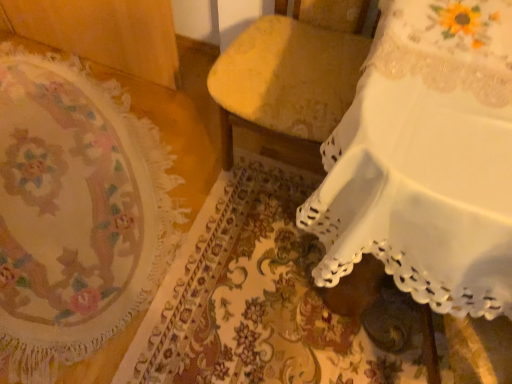
What do you see at coordinates (426, 160) in the screenshot? I see `white lace tablecloth at upper right, the 1th furniture from the right` at bounding box center [426, 160].

The width and height of the screenshot is (512, 384). What do you see at coordinates (76, 212) in the screenshot? I see `floral tapestry at left` at bounding box center [76, 212].

This screenshot has height=384, width=512. Find the location of `white lace tablecloth at upper right, the 1th furniture from the right`. white lace tablecloth at upper right, the 1th furniture from the right is located at coordinates (426, 160).

From a real-world perspective, who is located higher, velvet yellow chair at center, which appears as the second furniture when viewed from the right, or floral tapestry at left?

From a 3D spatial view, velvet yellow chair at center, which appears as the second furniture when viewed from the right, is above.

From the image's perspective, is velvet yellow chair at center, which ranks as the first furniture in left-to-right order, on floral tapestry at left?

Yes, from the image's perspective, velvet yellow chair at center, which ranks as the first furniture in left-to-right order, is on top of floral tapestry at left.

Is velvet yellow chair at center, which appears as the second furniture when viewed from the right, taller than floral tapestry at left?

Indeed, velvet yellow chair at center, which appears as the second furniture when viewed from the right, has a greater height compared to floral tapestry at left.

Is velvet yellow chair at center, which appears as the second furniture when viewed from the right, oriented towards floral tapestry at left?

No, velvet yellow chair at center, which appears as the second furniture when viewed from the right, is not facing towards floral tapestry at left.

Consider the image. Is velvet yellow chair at center, which appears as the second furniture when viewed from the right, in front of white lace tablecloth at upper right, which appears as the second furniture when viewed from the left?

That is False.

Which of these two, velvet yellow chair at center, which ranks as the first furniture in left-to-right order, or white lace tablecloth at upper right, the 1th furniture from the right, is smaller?

Smaller between the two is velvet yellow chair at center, which ranks as the first furniture in left-to-right order.

Is velvet yellow chair at center, which ranks as the first furniture in left-to-right order, turned away from white lace tablecloth at upper right, which appears as the second furniture when viewed from the left?

No.

Who is shorter, velvet yellow chair at center, which ranks as the first furniture in left-to-right order, or white lace tablecloth at upper right, which appears as the second furniture when viewed from the left?

With less height is white lace tablecloth at upper right, which appears as the second furniture when viewed from the left.

Would you say floral tapestry at left is outside velvet yellow chair at center, which ranks as the first furniture in left-to-right order?

Yes, floral tapestry at left is outside of velvet yellow chair at center, which ranks as the first furniture in left-to-right order.

Which is more distant, (x=41, y=214) or (x=306, y=38)?

The point (x=41, y=214) is behind.

From the image's perspective, between floral tapestry at left and velvet yellow chair at center, which appears as the second furniture when viewed from the right, which one is located above?

velvet yellow chair at center, which appears as the second furniture when viewed from the right, is shown above in the image.

Considering the sizes of white lace tablecloth at upper right, the 1th furniture from the right, and floral tapestry at left in the image, is white lace tablecloth at upper right, the 1th furniture from the right, taller or shorter than floral tapestry at left?

Considering their sizes, white lace tablecloth at upper right, the 1th furniture from the right, has more height than floral tapestry at left.

Is point (482, 231) less distant than point (8, 369)?

That is True.

Consider the image. Could you tell me if white lace tablecloth at upper right, the 1th furniture from the right, is turned towards floral tapestry at left?

No, white lace tablecloth at upper right, the 1th furniture from the right, does not turn towards floral tapestry at left.

Can you confirm if white lace tablecloth at upper right, which appears as the second furniture when viewed from the left, is smaller than floral tapestry at left?

No, white lace tablecloth at upper right, which appears as the second furniture when viewed from the left, is not smaller than floral tapestry at left.

Is white lace tablecloth at upper right, the 1th furniture from the right, taller than velvet yellow chair at center, which appears as the second furniture when viewed from the right?

No, white lace tablecloth at upper right, the 1th furniture from the right, is not taller than velvet yellow chair at center, which appears as the second furniture when viewed from the right.

Which of these two, white lace tablecloth at upper right, the 1th furniture from the right, or velvet yellow chair at center, which ranks as the first furniture in left-to-right order, is bigger?

With larger size is white lace tablecloth at upper right, the 1th furniture from the right.

From the image's perspective, between white lace tablecloth at upper right, which appears as the second furniture when viewed from the left, and velvet yellow chair at center, which ranks as the first furniture in left-to-right order, who is located below?

white lace tablecloth at upper right, which appears as the second furniture when viewed from the left, from the image's perspective.

From a real-world perspective, between white lace tablecloth at upper right, the 1th furniture from the right, and velvet yellow chair at center, which appears as the second furniture when viewed from the right, who is vertically higher?

velvet yellow chair at center, which appears as the second furniture when viewed from the right, from a real-world perspective.

Can you confirm if floral tapestry at left is positioned to the left of white lace tablecloth at upper right, which appears as the second furniture when viewed from the left?

Yes, floral tapestry at left is to the left of white lace tablecloth at upper right, which appears as the second furniture when viewed from the left.

Find the location of a particular element. This screenshot has height=384, width=512. the 2nd furniture to the right of the floral tapestry at left, counting from the anchor's position is located at coordinates (426, 160).

Is floral tapestry at left closer to camera compared to white lace tablecloth at upper right, the 1th furniture from the right?

No, it is behind white lace tablecloth at upper right, the 1th furniture from the right.

Is floral tapestry at left far away from white lace tablecloth at upper right, the 1th furniture from the right?

No, floral tapestry at left is in close proximity to white lace tablecloth at upper right, the 1th furniture from the right.

Where is `mat below the velvet yellow chair at center, which ranks as the first furniture in left-to-right order (from a real-world perspective)`? This screenshot has height=384, width=512. mat below the velvet yellow chair at center, which ranks as the first furniture in left-to-right order (from a real-world perspective) is located at coordinates (76, 212).

The width and height of the screenshot is (512, 384). Find the location of `furniture above the white lace tablecloth at upper right, which appears as the second furniture when viewed from the left (from the image's perspective)`. furniture above the white lace tablecloth at upper right, which appears as the second furniture when viewed from the left (from the image's perspective) is located at coordinates (291, 73).

Considering their positions, is white lace tablecloth at upper right, which appears as the second furniture when viewed from the left, positioned further to floral tapestry at left than velvet yellow chair at center, which ranks as the first furniture in left-to-right order?

Based on the image, white lace tablecloth at upper right, which appears as the second furniture when viewed from the left, appears to be further to floral tapestry at left.

Considering their positions, is velvet yellow chair at center, which ranks as the first furniture in left-to-right order, positioned closer to white lace tablecloth at upper right, the 1th furniture from the right, than floral tapestry at left?

Based on the image, velvet yellow chair at center, which ranks as the first furniture in left-to-right order, appears to be nearer to white lace tablecloth at upper right, the 1th furniture from the right.

From the image, which object appears to be farther from floral tapestry at left, velvet yellow chair at center, which ranks as the first furniture in left-to-right order, or white lace tablecloth at upper right, the 1th furniture from the right?

Among the two, white lace tablecloth at upper right, the 1th furniture from the right, is located further to floral tapestry at left.

From the image, which object appears to be farther from velvet yellow chair at center, which appears as the second furniture when viewed from the right, white lace tablecloth at upper right, the 1th furniture from the right, or floral tapestry at left?

floral tapestry at left is positioned further to the anchor velvet yellow chair at center, which appears as the second furniture when viewed from the right.

Looking at the image, which one is located closer to velvet yellow chair at center, which ranks as the first furniture in left-to-right order, floral tapestry at left or white lace tablecloth at upper right, which appears as the second furniture when viewed from the left?

Among the two, white lace tablecloth at upper right, which appears as the second furniture when viewed from the left, is located nearer to velvet yellow chair at center, which ranks as the first furniture in left-to-right order.

In the scene shown: Considering their positions, is floral tapestry at left positioned further to white lace tablecloth at upper right, the 1th furniture from the right, than velvet yellow chair at center, which ranks as the first furniture in left-to-right order?

Among the two, floral tapestry at left is located further to white lace tablecloth at upper right, the 1th furniture from the right.

The height and width of the screenshot is (384, 512). What are the coordinates of `furniture located between floral tapestry at left and white lace tablecloth at upper right, the 1th furniture from the right, in the left-right direction` in the screenshot? It's located at (291, 73).